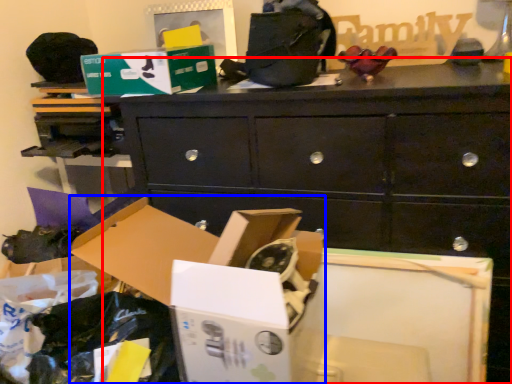
Question: Which object appears closest to the camera in this image, chest of drawers (highlighted by a red box) or storage box (highlighted by a blue box)?

Choices:
 (A) chest of drawers
 (B) storage box

Answer: (B)